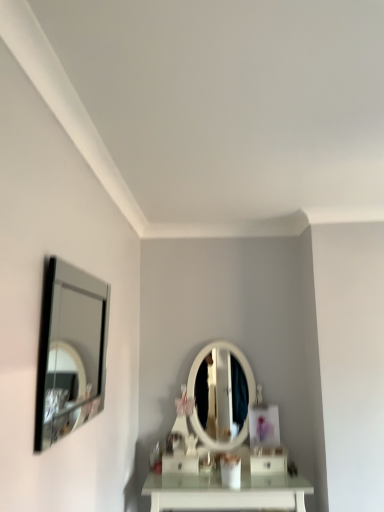
Locate an element on the screen. free spot above white glossy drawer at center, arranged as the 2th drawer when viewed from the right (from a real-world perspective) is located at coordinates (178, 452).